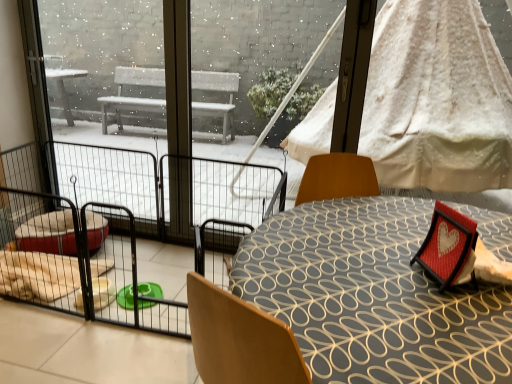
Locate an element on the screen. This screenshot has width=512, height=384. vacant space situated on the left part of red fabric heart frame at lower right is located at coordinates (378, 262).